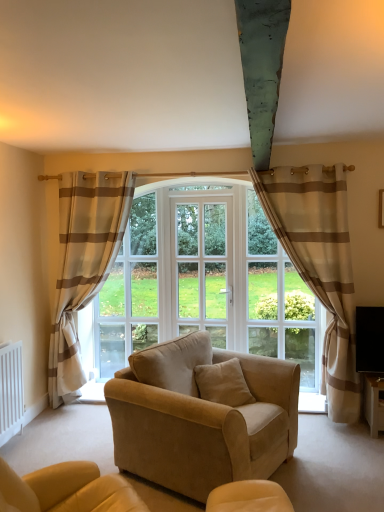
Question: From the image's perspective, is beige striped curtain at left, the 1th curtain when ordered from left to right, on top of clear glass window at center?

Choices:
 (A) yes
 (B) no

Answer: (A)

Question: Is beige striped curtain at left, acting as the second curtain starting from the right, closer to camera compared to clear glass window at center?

Choices:
 (A) no
 (B) yes

Answer: (B)

Question: Can you confirm if beige striped curtain at left, the 1th curtain when ordered from left to right, is shorter than clear glass window at center?

Choices:
 (A) yes
 (B) no

Answer: (B)

Question: Considering the relative sizes of beige striped curtain at left, the 1th curtain when ordered from left to right, and clear glass window at center in the image provided, is beige striped curtain at left, the 1th curtain when ordered from left to right, bigger than clear glass window at center?

Choices:
 (A) no
 (B) yes

Answer: (B)

Question: Is beige striped curtain at left, the 1th curtain when ordered from left to right, facing towards clear glass window at center?

Choices:
 (A) yes
 (B) no

Answer: (A)

Question: Does beige striped curtain at left, the 1th curtain when ordered from left to right, have a lesser width compared to clear glass window at center?

Choices:
 (A) yes
 (B) no

Answer: (B)

Question: Is the position of beige striped curtain at right, the second curtain from the left, more distant than that of white glass screen door at center?

Choices:
 (A) yes
 (B) no

Answer: (B)

Question: Is beige striped curtain at right, the 1th curtain from the right, taller than white glass screen door at center?

Choices:
 (A) no
 (B) yes

Answer: (B)

Question: Does beige striped curtain at right, the second curtain from the left, come in front of white glass screen door at center?

Choices:
 (A) yes
 (B) no

Answer: (A)

Question: Is beige striped curtain at right, the 1th curtain from the right, to the left of white glass screen door at center from the viewer's perspective?

Choices:
 (A) no
 (B) yes

Answer: (A)

Question: Is beige striped curtain at right, the 1th curtain from the right, outside white glass screen door at center?

Choices:
 (A) yes
 (B) no

Answer: (A)

Question: Is white glass screen door at center at the back of beige striped curtain at right, the second curtain from the left?

Choices:
 (A) no
 (B) yes

Answer: (A)

Question: Is beige striped curtain at right, the 1th curtain from the right, aimed at white plastic radiator at lower left?

Choices:
 (A) no
 (B) yes

Answer: (A)